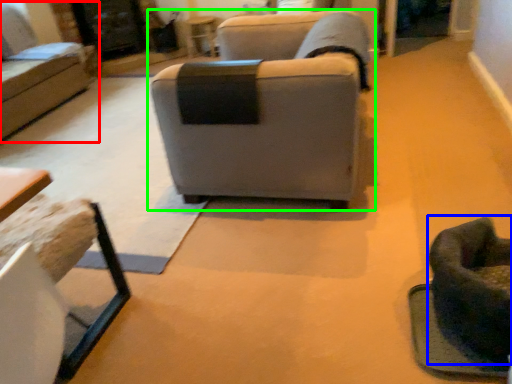
Question: Estimate the real-world distances between objects in this image. Which object is farther from studio couch (highlighted by a red box), swivel chair (highlighted by a blue box) or studio couch (highlighted by a green box)?

Choices:
 (A) swivel chair
 (B) studio couch

Answer: (A)